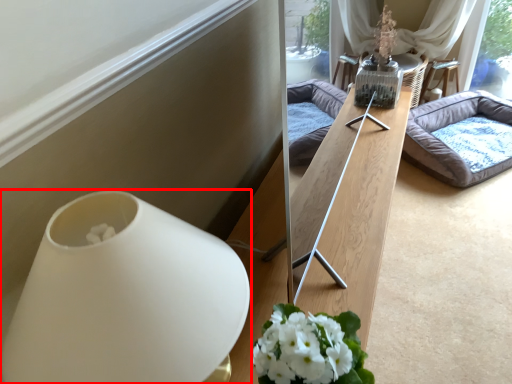
Question: From the image's perspective, what is the correct spatial relationship of vase (annotated by the red box) in relation to studio couch?

Choices:
 (A) below
 (B) above

Answer: (A)